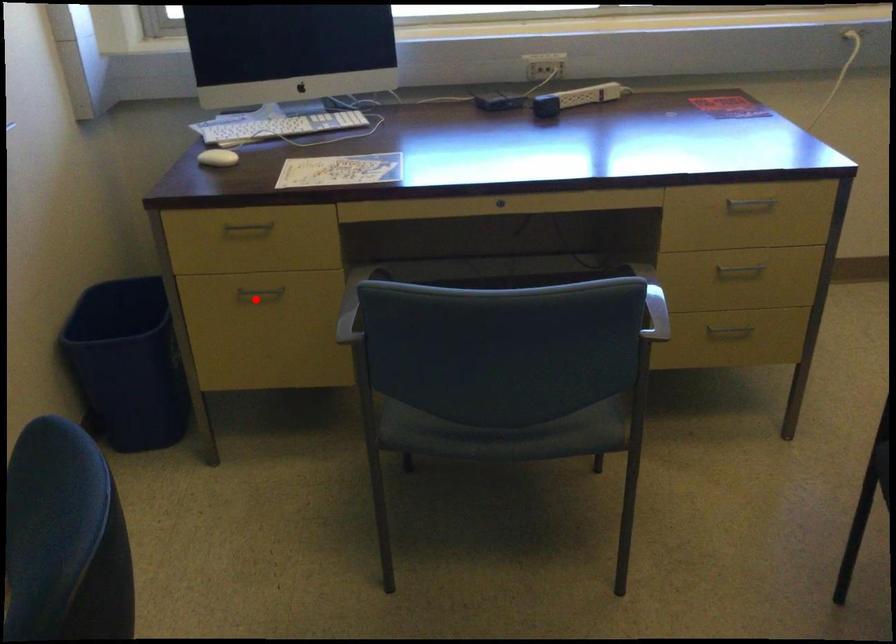
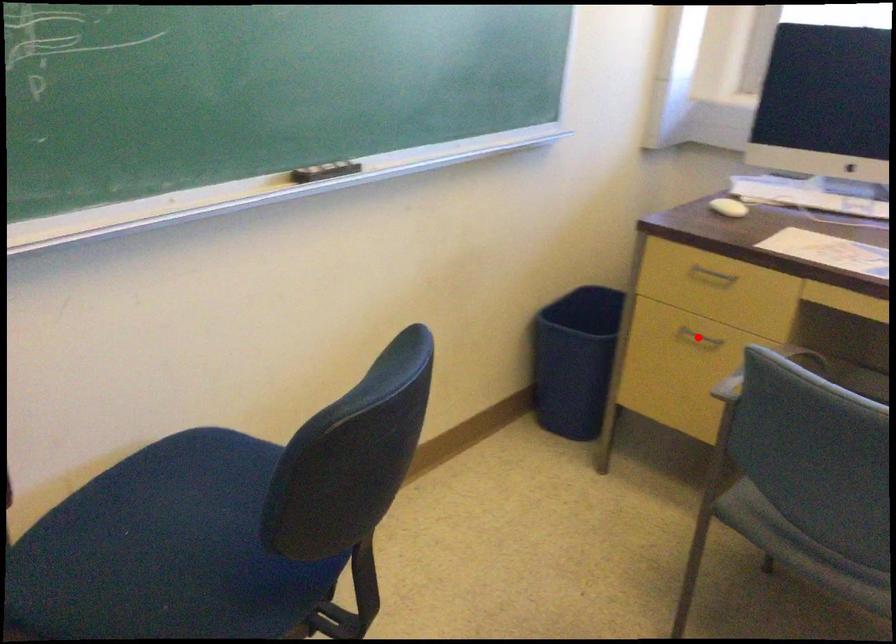
I am providing you with two images of the same scene from different viewpoints. A red point is marked on the first image and another point is marked on the second image. Do the highlighted points in image1 and image2 indicate the same real-world spot?

Yes